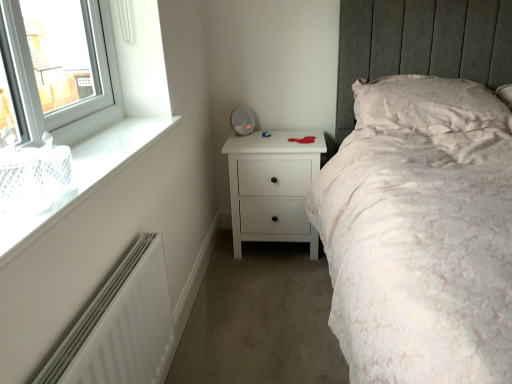
Question: Considering the relative positions of white matte chest of drawers at center and white glass window at upper left in the image provided, is white matte chest of drawers at center in front of white glass window at upper left?

Choices:
 (A) yes
 (B) no

Answer: (B)

Question: Can you confirm if white matte chest of drawers at center is shorter than white glass window at upper left?

Choices:
 (A) no
 (B) yes

Answer: (A)

Question: Can you confirm if white matte chest of drawers at center is wider than white glass window at upper left?

Choices:
 (A) yes
 (B) no

Answer: (A)

Question: Does white matte chest of drawers at center contain white glass window at upper left?

Choices:
 (A) no
 (B) yes

Answer: (A)

Question: Does white matte chest of drawers at center have a greater height compared to white glass window at upper left?

Choices:
 (A) yes
 (B) no

Answer: (A)

Question: Is white matte chest of drawers at center with white glass window at upper left?

Choices:
 (A) yes
 (B) no

Answer: (B)

Question: From the image's perspective, is white matte chest of drawers at center over white textured pillow at upper right?

Choices:
 (A) yes
 (B) no

Answer: (B)

Question: Is white matte chest of drawers at center oriented towards white textured pillow at upper right?

Choices:
 (A) yes
 (B) no

Answer: (B)

Question: From the image's perspective, is white matte chest of drawers at center beneath white textured pillow at upper right?

Choices:
 (A) no
 (B) yes

Answer: (B)

Question: From a real-world perspective, is white matte chest of drawers at center located beneath white textured pillow at upper right?

Choices:
 (A) no
 (B) yes

Answer: (B)

Question: Considering the relative sizes of white matte chest of drawers at center and white textured pillow at upper right in the image provided, is white matte chest of drawers at center smaller than white textured pillow at upper right?

Choices:
 (A) yes
 (B) no

Answer: (B)

Question: Is white matte chest of drawers at center shorter than white textured pillow at upper right?

Choices:
 (A) yes
 (B) no

Answer: (B)

Question: Does white matte radiator at lower left have a larger size compared to white glass window at upper left?

Choices:
 (A) yes
 (B) no

Answer: (A)